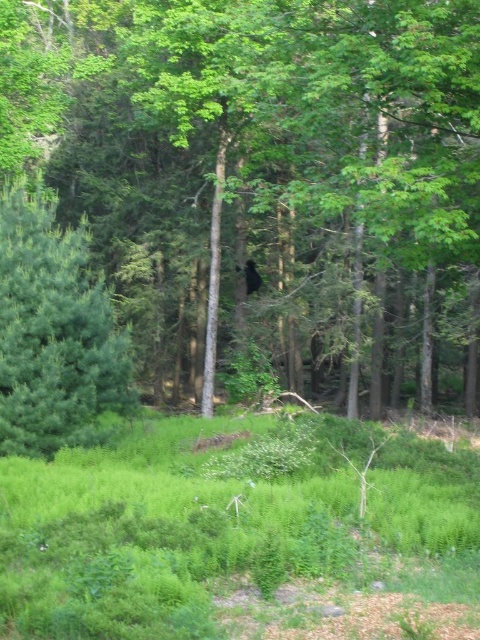
Is green leafy tree at center to the left of green leafy grass at center from the viewer's perspective?

Correct, you'll find green leafy tree at center to the left of green leafy grass at center.

How far apart are green leafy tree at center and green leafy grass at center?

green leafy tree at center and green leafy grass at center are 9.11 meters apart from each other.

Is point (403, 196) less distant than point (361, 428)?

Yes, point (403, 196) is closer to viewer.

Locate an element on the screen. green leafy tree at center is located at coordinates (265, 177).

Does green leafy tree at center have a greater height compared to green matte tree at left?

Yes.

Does point (193, 164) come closer to viewer compared to point (75, 355)?

No, it is not.

Identify the location of green leafy tree at center. (265, 177).

Is green leafy grass at center closer to camera compared to green matte tree at left?

Yes, it is.

From the picture: Between green leafy grass at center and green matte tree at left, which one has more height?

With more height is green leafy grass at center.

At what (x,y) coordinates should I click in order to perform the action: click on green leafy grass at center. Please return your answer as a coordinate pair (x, y). The image size is (480, 640). Looking at the image, I should click on (224, 522).